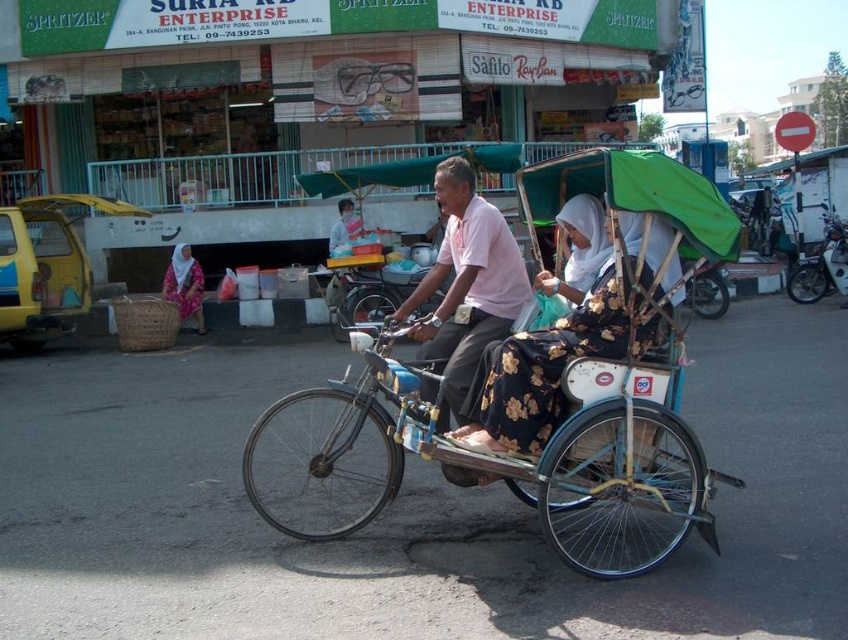
You are standing at point [187,284] and want to walk to point [441,353]. Which direction should you move relative to the street scene?

You should move forward towards point [441,353] since it is in front of your current position at point [187,284].

You are a photographer standing in the street scene. You want to take a photo of both the rickshaw driver and the passenger in the black floral dress. The driver is at point (x=835, y=243) and the passenger is at point (x=171, y=256). Can you fit both of them in the frame without moving your position?

Point (x=835, y=243) is further to the camera than point (x=171, y=256). Since the driver is closer to you and the passenger is farther away, you can fit both in the frame by adjusting the zoom or angle to include both positions.